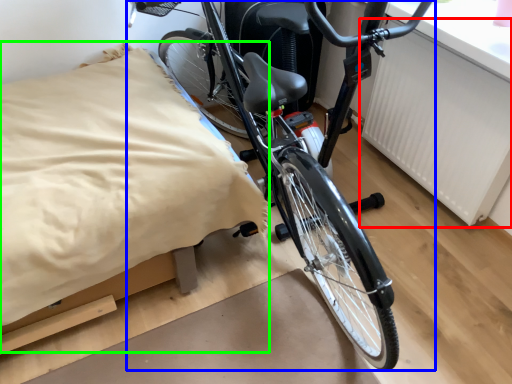
Question: Which object is the closest to the radiator (highlighted by a red box)? Choose among these: bicycle (highlighted by a blue box) or sheet (highlighted by a green box).

Choices:
 (A) bicycle
 (B) sheet

Answer: (A)